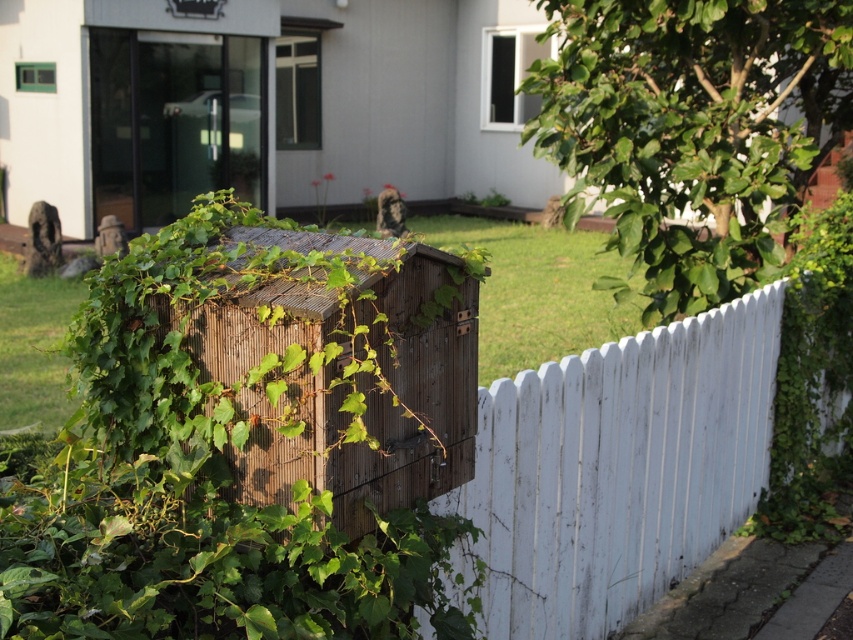
Does green leafy ivy at center lie behind white wooden fence at center?

That is False.

Which of these two, green leafy ivy at center or white wooden fence at center, stands shorter?

green leafy ivy at center

Locate an element on the screen. The image size is (853, 640). green leafy ivy at center is located at coordinates (201, 474).